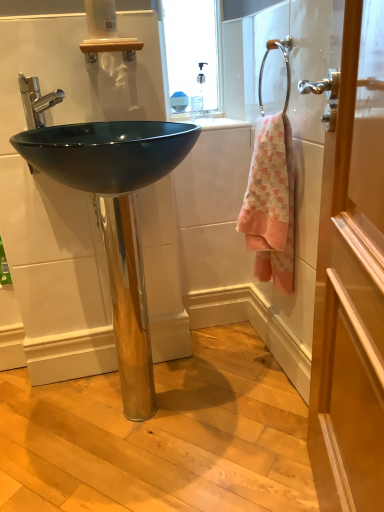
The width and height of the screenshot is (384, 512). What do you see at coordinates (117, 219) in the screenshot?
I see `glossy black sink at center` at bounding box center [117, 219].

This screenshot has height=512, width=384. I want to click on glossy black sink at center, so click(117, 219).

The image size is (384, 512). Find the location of `chrome metallic towel ring at upper right`. chrome metallic towel ring at upper right is located at coordinates (286, 67).

Identify the location of wooden door at right. This screenshot has width=384, height=512. (351, 281).

You are a GUI agent. You are given a task and a screenshot of the screen. Output one action in this format:
    pyautogui.click(x=<x>, y=<y>)
    Task: Click on the glossy black sink at center
    
    Given the screenshot: What is the action you would take?
    pyautogui.click(x=117, y=219)

Could you tell me if glossy black sink at center is facing polished chrome faucet at upper left?

No.

Is glossy black sink at center not inside polished chrome faucet at upper left?

Indeed, glossy black sink at center is completely outside polished chrome faucet at upper left.

Considering the relative positions of glossy black sink at center and polished chrome faucet at upper left in the image provided, is glossy black sink at center to the left of polished chrome faucet at upper left from the viewer's perspective?

No.

In terms of width, does polished chrome faucet at upper left look wider or thinner when compared to glossy black sink at center?

Considering their sizes, polished chrome faucet at upper left looks slimmer than glossy black sink at center.

Is polished chrome faucet at upper left positioned with its back to glossy black sink at center?

polished chrome faucet at upper left is not turned away from glossy black sink at center.

Are polished chrome faucet at upper left and glossy black sink at center beside each other?

polished chrome faucet at upper left and glossy black sink at center are not in contact.

Which is closer to the camera, (285, 42) or (135, 331)?

The point (285, 42) is closer to the camera.

Considering the relative sizes of chrome metallic towel ring at upper right and glossy black sink at center in the image provided, is chrome metallic towel ring at upper right shorter than glossy black sink at center?

Correct, chrome metallic towel ring at upper right is not as tall as glossy black sink at center.

Do you think chrome metallic towel ring at upper right is within glossy black sink at center, or outside of it?

chrome metallic towel ring at upper right is located beyond the bounds of glossy black sink at center.

Considering the relative positions of wooden door at right and polished chrome faucet at upper left in the image provided, is wooden door at right to the left or to the right of polished chrome faucet at upper left?

Clearly, wooden door at right is on the right of polished chrome faucet at upper left in the image.

Does wooden door at right come behind polished chrome faucet at upper left?

No, it is in front of polished chrome faucet at upper left.

Is wooden door at right completely or partially outside of polished chrome faucet at upper left?

Indeed, wooden door at right is completely outside polished chrome faucet at upper left.

Considering the positions of point (336, 341) and point (23, 89), is point (336, 341) closer or farther from the camera than point (23, 89)?

Clearly, point (336, 341) is closer to the camera than point (23, 89).

Can you confirm if pink woven towel at right is positioned to the right of polished chrome faucet at upper left?

Correct, you'll find pink woven towel at right to the right of polished chrome faucet at upper left.

Between pink woven towel at right and polished chrome faucet at upper left, which one has more height?

With more height is pink woven towel at right.

Is pink woven towel at right beside polished chrome faucet at upper left?

They are not placed beside each other.

Is polished chrome faucet at upper left at the right side of chrome metallic towel ring at upper right?

No, polished chrome faucet at upper left is not to the right of chrome metallic towel ring at upper right.

Considering the relative sizes of polished chrome faucet at upper left and chrome metallic towel ring at upper right in the image provided, is polished chrome faucet at upper left bigger than chrome metallic towel ring at upper right?

No.

Which object is wider, polished chrome faucet at upper left or chrome metallic towel ring at upper right?

polished chrome faucet at upper left.

Which is in front, point (34, 93) or point (286, 92)?

Point (34, 93)

From the image's perspective, is chrome metallic towel ring at upper right above or below polished chrome faucet at upper left?

From the image's perspective, chrome metallic towel ring at upper right appears above polished chrome faucet at upper left.

Find the location of a particular element. The image size is (384, 512). tap behind the chrome metallic towel ring at upper right is located at coordinates (36, 101).

Between chrome metallic towel ring at upper right and polished chrome faucet at upper left, which one has larger width?

polished chrome faucet at upper left is wider.

The image size is (384, 512). I want to click on tap on the left of the glossy black sink at center, so tap(36, 101).

This screenshot has width=384, height=512. Find the location of `tap behind the glossy black sink at center`. tap behind the glossy black sink at center is located at coordinates (36, 101).

When comparing their distances from wooden door at right, does glossy black sink at center or chrome metallic towel ring at upper right seem further?

Among the two, chrome metallic towel ring at upper right is located further to wooden door at right.

Based on their spatial positions, is wooden door at right or pink woven towel at right closer to glossy black sink at center?

The object closer to glossy black sink at center is pink woven towel at right.

Looking at the image, which one is located further to wooden door at right, chrome metallic towel ring at upper right or polished chrome faucet at upper left?

polished chrome faucet at upper left is positioned further to the anchor wooden door at right.

Estimate the real-world distances between objects in this image. Which object is closer to chrome metallic towel ring at upper right, pink woven towel at right or polished chrome faucet at upper left?

Based on the image, pink woven towel at right appears to be nearer to chrome metallic towel ring at upper right.

Which object lies further to the anchor point pink woven towel at right, wooden door at right or glossy black sink at center?

Based on the image, wooden door at right appears to be further to pink woven towel at right.

When comparing their distances from chrome metallic towel ring at upper right, does pink woven towel at right or wooden door at right seem closer?

pink woven towel at right lies closer to chrome metallic towel ring at upper right than the other object.

In the scene shown: Based on their spatial positions, is polished chrome faucet at upper left or wooden door at right closer to pink woven towel at right?

Among the two, wooden door at right is located nearer to pink woven towel at right.

Which object lies nearer to the anchor point pink woven towel at right, glossy black sink at center or wooden door at right?

glossy black sink at center lies closer to pink woven towel at right than the other object.

Locate an element on the screen. Image resolution: width=384 pixels, height=512 pixels. sink between wooden door at right and chrome metallic towel ring at upper right from front to back is located at coordinates (117, 219).

Find the location of `tap positioned between wooden door at right and pink woven towel at right from near to far`. tap positioned between wooden door at right and pink woven towel at right from near to far is located at coordinates (36, 101).

Identify the location of shower between wooden door at right and polished chrome faucet at upper left in the front-back direction. The width and height of the screenshot is (384, 512). (286, 67).

In order to click on sink positioned between wooden door at right and polished chrome faucet at upper left from near to far in this screenshot , I will do `click(117, 219)`.